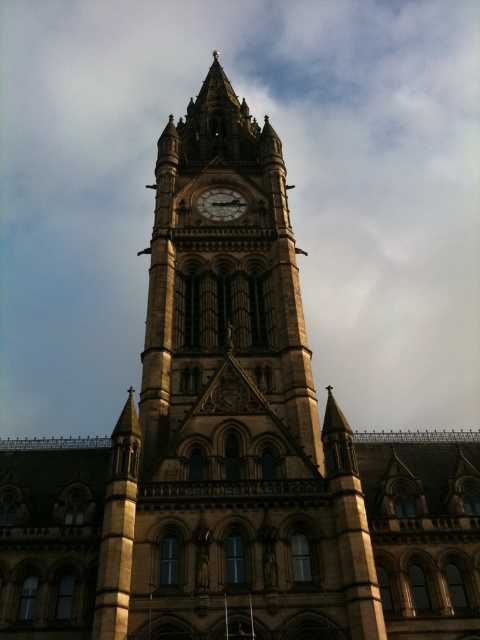
You are a tourist standing in front of the clock tower and want to take a photo that includes both the golden stone clock tower at center and the dark brown wooden clock at center. Which object should you focus on first to ensure both are in frame?

The golden stone clock tower at center is larger than the dark brown wooden clock at center, so you should focus on the golden stone clock tower at center first to ensure both are in frame.